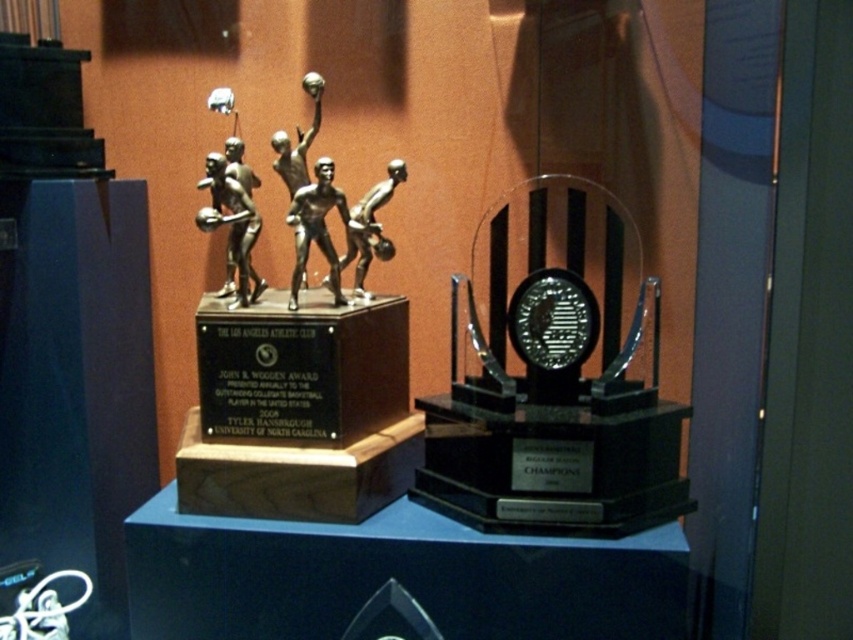
Is point (315, 205) less distant than point (329, 276)?

Yes, point (315, 205) is in front of point (329, 276).

Does bronze figure at center appear on the right side of silver metallic basketball players at center?

In fact, bronze figure at center is to the left of silver metallic basketball players at center.

Between point (308, 250) and point (364, 241), which one is positioned behind?

The point (364, 241) is more distant.

Where is `bronze figure at center`? Image resolution: width=853 pixels, height=640 pixels. bronze figure at center is located at coordinates (316, 227).

Is point (219, 154) more distant than point (321, 192)?

That is True.

This screenshot has height=640, width=853. What do you see at coordinates (231, 224) in the screenshot?
I see `bronze metallic basketball players at center` at bounding box center [231, 224].

I want to click on bronze metallic basketball players at center, so click(231, 224).

Is bronze metallic basketball players at center to the right of silver metallic basketball players at center from the viewer's perspective?

In fact, bronze metallic basketball players at center is to the left of silver metallic basketball players at center.

Is bronze metallic basketball players at center above silver metallic basketball players at center?

No, bronze metallic basketball players at center is not above silver metallic basketball players at center.

Is point (202, 180) positioned in front of point (378, 192)?

Yes, it is.

Locate an element on the screen. bronze metallic basketball players at center is located at coordinates (231, 224).